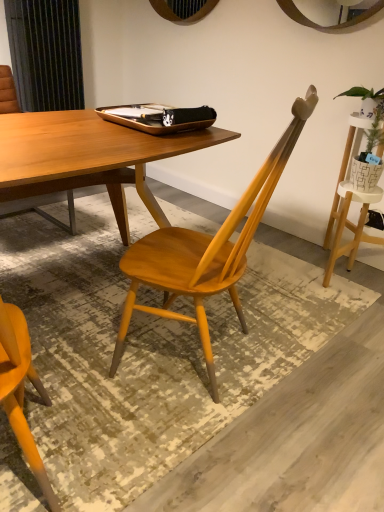
Question: Is point (236, 258) closer or farther from the camera than point (357, 92)?

Choices:
 (A) closer
 (B) farther

Answer: (A)

Question: From their relative heights in the image, would you say matte wood chair at center is taller or shorter than green leafy plant in woven basket at upper right?

Choices:
 (A) tall
 (B) short

Answer: (A)

Question: Based on their relative distances, which object is farther from the wooden tray at center?

Choices:
 (A) green leafy plant in woven basket at upper right
 (B) matte wood chair at center

Answer: (A)

Question: Which of these objects is positioned farthest from the matte wood chair at center?

Choices:
 (A) green leafy plant in woven basket at upper right
 (B) wooden tray at center

Answer: (A)